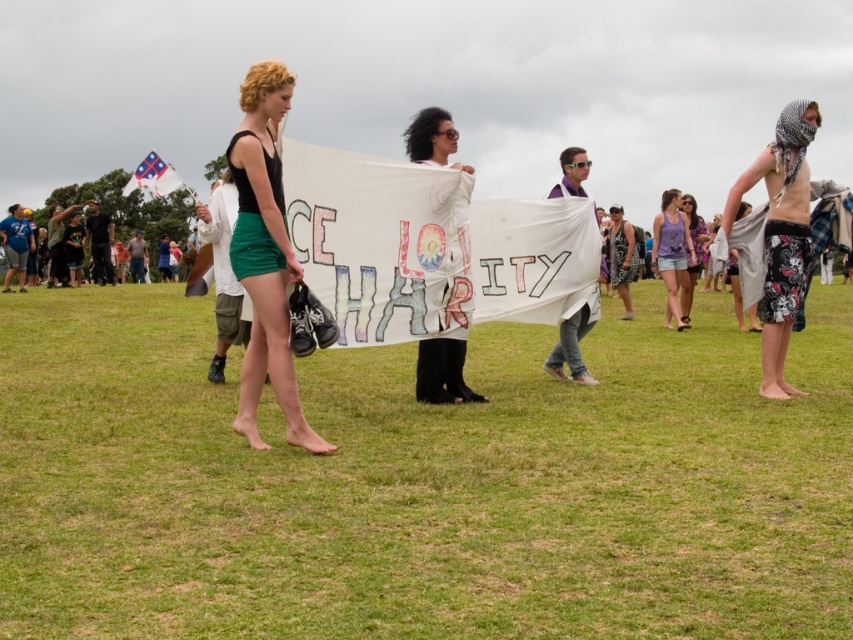
Question: Can you confirm if green grass at center is positioned to the right of matte purple tank top at center?

Choices:
 (A) no
 (B) yes

Answer: (A)

Question: Among these objects, which one is farthest from the camera?

Choices:
 (A) black textured dress at center
 (B) matte purple tank top at center
 (C) purple cotton tank top at center

Answer: (A)

Question: Which point appears closest to the camera in this image?

Choices:
 (A) (544, 362)
 (B) (277, 198)

Answer: (B)

Question: Can you confirm if purple fabric at center is thinner than matte purple tank top at center?

Choices:
 (A) yes
 (B) no

Answer: (A)

Question: Estimate the real-world distances between objects in this image. Which object is closer to the matte black tank top at center?

Choices:
 (A) purple fabric at center
 (B) white fabric banner at center
 (C) purple cotton tank top at center

Answer: (B)

Question: Can you confirm if matte black tank top at center is wider than purple cotton tank top at center?

Choices:
 (A) yes
 (B) no

Answer: (A)